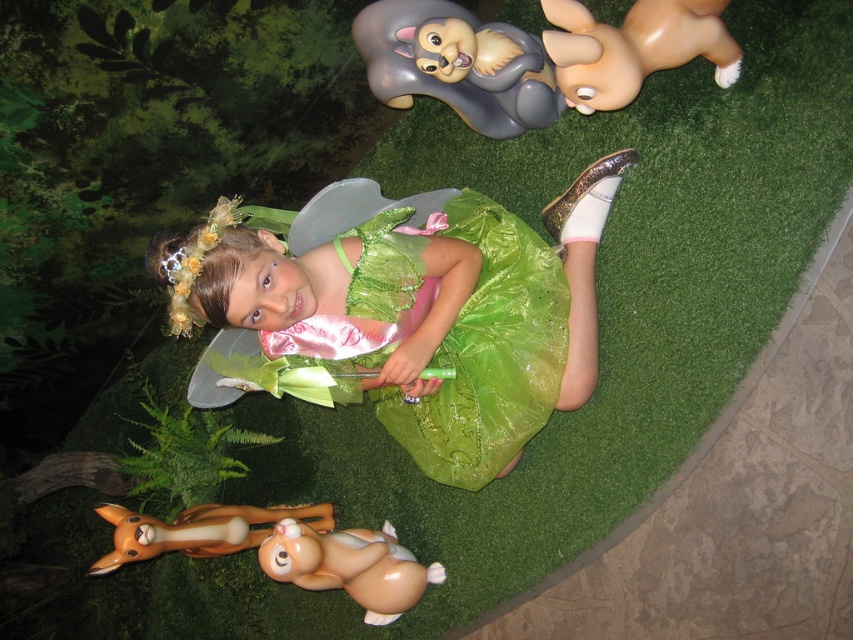
You are a photographer standing in front of the green tulle dress at center. You want to take a closeup shot of the dress without getting too close. Your camera has a maximum zoom range of 1.5 meters. Can you capture the dress clearly from your current position?

The green tulle dress at center and viewer are 1.37 meters apart from each other. Since the camera can zoom up to 1.5 meters, you can capture the dress clearly from your current position as the distance is within the camera range.